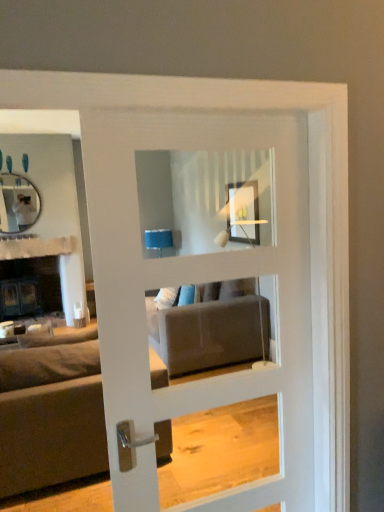
What are the coordinates of `matte black mirror at upper left` in the screenshot? It's located at (17, 203).

From a real-world perspective, who is located higher, matte black mirror at upper left or dark gray fabric couch at left?

In real-world perspective, matte black mirror at upper left is above.

Are matte black mirror at upper left and dark gray fabric couch at left making contact?

No, matte black mirror at upper left is not in contact with dark gray fabric couch at left.

Which of these two, matte black mirror at upper left or dark gray fabric couch at left, is thinner?

With smaller width is matte black mirror at upper left.

Is matte black mirror at upper left facing towards dark gray fabric couch at left?

Yes, matte black mirror at upper left is turned towards dark gray fabric couch at left.

Which of these two, dark gray fabric couch at left or white glossy door at center, is smaller?

With smaller size is white glossy door at center.

Does dark gray fabric couch at left touch white glossy door at center?

They are not placed beside each other.

Is dark gray fabric couch at left not within white glossy door at center?

Absolutely, dark gray fabric couch at left is external to white glossy door at center.

Which of these two, dark gray fabric couch at left or white glossy door at center, is thinner?

white glossy door at center.

Between matte black mirror at upper left and white textured fabric at upper left, which one is positioned in front?

matte black mirror at upper left is closer to the camera.

Considering the relative positions of matte black mirror at upper left and white textured fabric at upper left in the image provided, is matte black mirror at upper left to the left of white textured fabric at upper left from the viewer's perspective?

Yes.

Considering the sizes of objects matte black mirror at upper left and white textured fabric at upper left in the image provided, who is smaller, matte black mirror at upper left or white textured fabric at upper left?

Smaller between the two is white textured fabric at upper left.

In the scene shown: Is white glossy door at center positioned far away from matte black mirror at upper left?

Yes.

Is point (168, 215) closer or farther from the camera than point (19, 219)?

Point (168, 215) is positioned farther from the camera compared to point (19, 219).

Is matte black mirror at upper left inside white glossy door at center?

No, white glossy door at center does not contain matte black mirror at upper left.

From the image's perspective, relative to matte black mirror at upper left, is white glossy door at center above or below?

Clearly, from the image's perspective, white glossy door at center is below matte black mirror at upper left.

Is matte black mirror at upper left surrounded by white textured fabric at upper left?

No.

Which object is closer to the camera, white textured fabric at upper left or matte black mirror at upper left?

matte black mirror at upper left is in front.

Can you confirm if white textured fabric at upper left is bigger than matte black mirror at upper left?

Incorrect, white textured fabric at upper left is not larger than matte black mirror at upper left.

How many degrees apart are the facing directions of white textured fabric at upper left and white glossy door at center?

white textured fabric at upper left and white glossy door at center are facing 179 degrees away from each other.

Image resolution: width=384 pixels, height=512 pixels. I want to click on door above the white textured fabric at upper left (from a real-world perspective), so click(194, 282).

Between white textured fabric at upper left and white glossy door at center, which one appears on the right side from the viewer's perspective?

Positioned to the right is white glossy door at center.

Which of these two, white textured fabric at upper left or white glossy door at center, is thinner?

Thinner between the two is white textured fabric at upper left.

Is matte black mirror at upper left looking in the opposite direction of white glossy door at center?

No, matte black mirror at upper left is not facing the opposite direction of white glossy door at center.

Choose the correct answer: Is matte black mirror at upper left inside white glossy door at center or outside it?

matte black mirror at upper left is outside white glossy door at center.

From the picture: Is matte black mirror at upper left positioned far away from white glossy door at center?

Yes, matte black mirror at upper left is far from white glossy door at center.

Considering the sizes of objects matte black mirror at upper left and white glossy door at center in the image provided, who is bigger, matte black mirror at upper left or white glossy door at center?

Bigger between the two is white glossy door at center.

I want to click on studio couch in front of the matte black mirror at upper left, so pyautogui.click(x=50, y=417).

Find the location of a particular element. This screenshot has width=384, height=512. studio couch on the left of white glossy door at center is located at coordinates (50, 417).

From the image, which object appears to be nearer to white textured fabric at upper left, dark gray fabric couch at left or white glossy door at center?

dark gray fabric couch at left is closer to white textured fabric at upper left.

Based on their spatial positions, is white glossy door at center or matte black mirror at upper left closer to white textured fabric at upper left?

Based on the image, matte black mirror at upper left appears to be nearer to white textured fabric at upper left.

Based on their spatial positions, is white textured fabric at upper left or dark gray fabric couch at left closer to matte black mirror at upper left?

Among the two, white textured fabric at upper left is located nearer to matte black mirror at upper left.

Based on their spatial positions, is matte black mirror at upper left or dark gray fabric couch at left closer to white textured fabric at upper left?

Based on the image, matte black mirror at upper left appears to be nearer to white textured fabric at upper left.

Considering their positions, is white textured fabric at upper left positioned further to matte black mirror at upper left than white glossy door at center?

white glossy door at center.

Based on their spatial positions, is dark gray fabric couch at left or matte black mirror at upper left further from white glossy door at center?

Based on the image, matte black mirror at upper left appears to be further to white glossy door at center.

Considering their positions, is dark gray fabric couch at left positioned further to white textured fabric at upper left than matte black mirror at upper left?

The object further to white textured fabric at upper left is dark gray fabric couch at left.

Which object lies further to the anchor point white glossy door at center, matte black mirror at upper left or white textured fabric at upper left?

matte black mirror at upper left is positioned further to the anchor white glossy door at center.

This screenshot has height=512, width=384. In order to click on mirror between dark gray fabric couch at left and white textured fabric at upper left in the front-back direction in this screenshot , I will do `click(17, 203)`.

You are a GUI agent. You are given a task and a screenshot of the screen. Output one action in this format:
    pyautogui.click(x=<x>, y=<y>)
    Task: Click on the studio couch between white glossy door at center and white textured fabric at upper left in the front-back direction
    
    Given the screenshot: What is the action you would take?
    pyautogui.click(x=50, y=417)

Identify the location of studio couch between white glossy door at center and matte black mirror at upper left from front to back. (50, 417).

This screenshot has height=512, width=384. Identify the location of mirror between white glossy door at center and white textured fabric at upper left in the front-back direction. (17, 203).